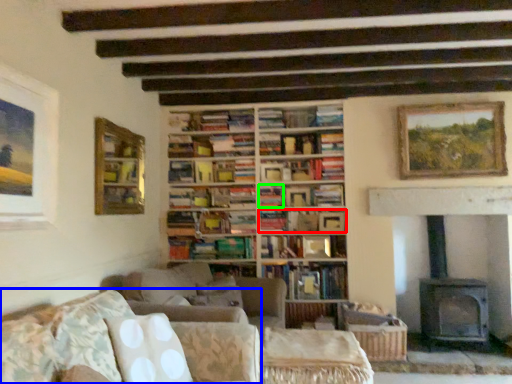
Question: Based on their relative distances, which object is farther from book (highlighted by a red box)? Choose from studio couch (highlighted by a blue box) and book (highlighted by a green box).

Choices:
 (A) studio couch
 (B) book

Answer: (A)